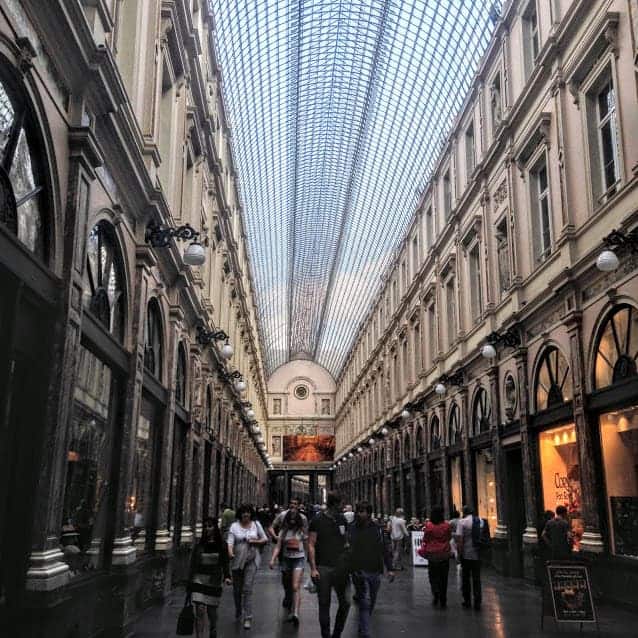
You are a GUI agent. You are given a task and a screenshot of the screen. Output one action in this format:
    pyautogui.click(x=<x>, y=<y>)
    Task: Click on the light
    The width and height of the screenshot is (638, 638).
    Given the screenshot: What is the action you would take?
    561,436